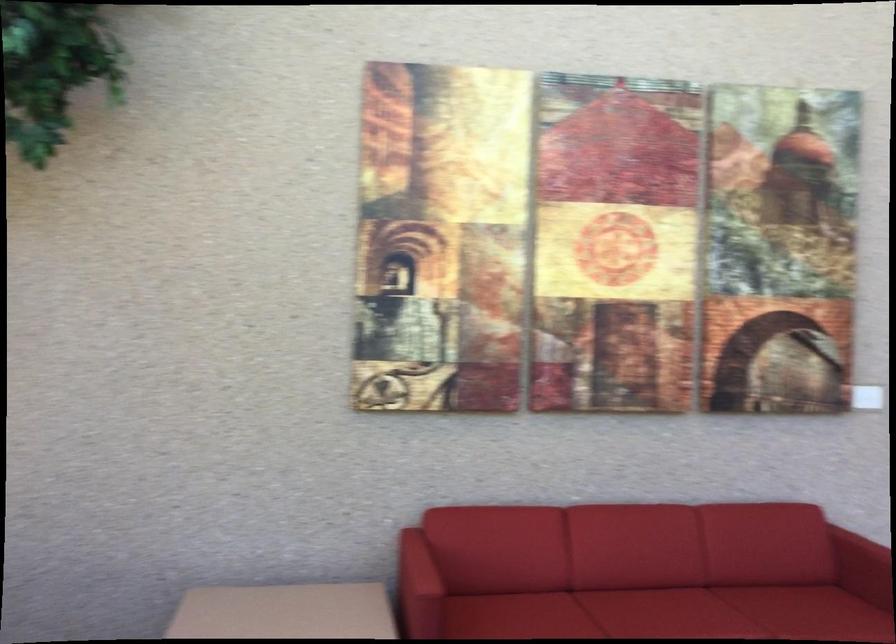
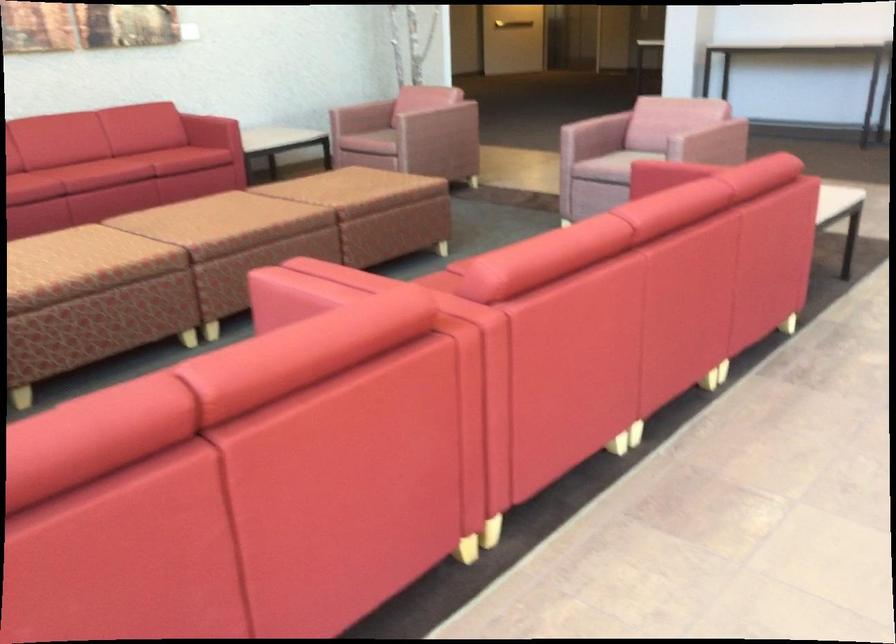
Question: I am providing you with two images of the same scene from different viewpoints. After the viewpoint changes to image2, which objects are now occluded?

Choices:
 (A) patterned brown ottoman
 (B) black round pan
 (C) pink chair sitting surface
 (D) red sofa sitting surface

Answer: (D)